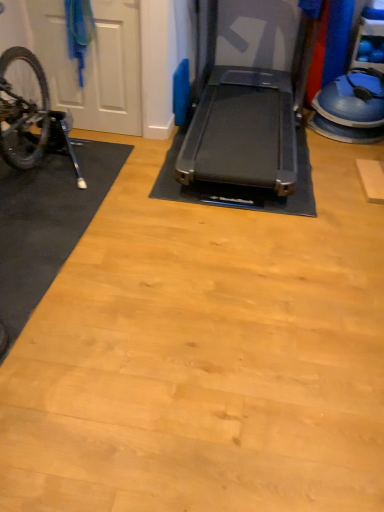
Question: Is point click(x=61, y=14) closer or farther from the camera than point click(x=64, y=140)?

Choices:
 (A) farther
 (B) closer

Answer: (A)

Question: Is white matte door at left situated inside shiny metallic bicycle at left or outside?

Choices:
 (A) outside
 (B) inside

Answer: (A)

Question: Which object is the closest to the shiny metallic bicycle at left?

Choices:
 (A) white matte door at left
 (B) black rubber mat at left
 (C) black rubber treadmill at center

Answer: (B)

Question: Based on their relative distances, which object is farther from the black rubber treadmill at center?

Choices:
 (A) shiny metallic bicycle at left
 (B) black rubber mat at left
 (C) white matte door at left

Answer: (A)